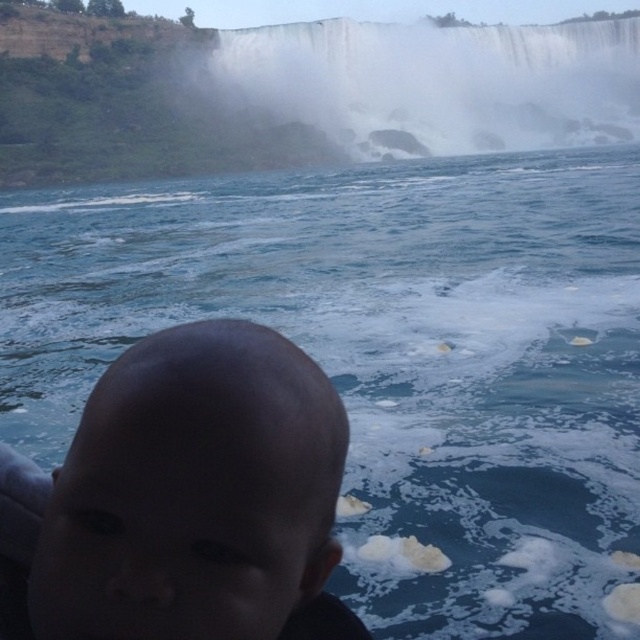
You are standing at the camera position and want to reach the point marked as point [157,577]. Given that your maximum comfortable walking distance is 30 feet, will you be able to comfortably walk to that point?

The distance between point [157,577] and the camera is 38.20 feet, which exceeds your maximum comfortable walking distance of 30 feet. Therefore, you will not be able to comfortably walk to that point.

What object is located at the coordinates point (x=184, y=499) in the image?

The point (x=184, y=499) corresponds to the dark skin head at center.

From the picture: You are a photographer trying to capture a clear shot of the dark skin head at center and the white misty waterfall at upper center. Based on the scene, which object is smaller in height?

The dark skin head at center is not as tall as the white misty waterfall at upper center, so the dark skin head at center is smaller in height.